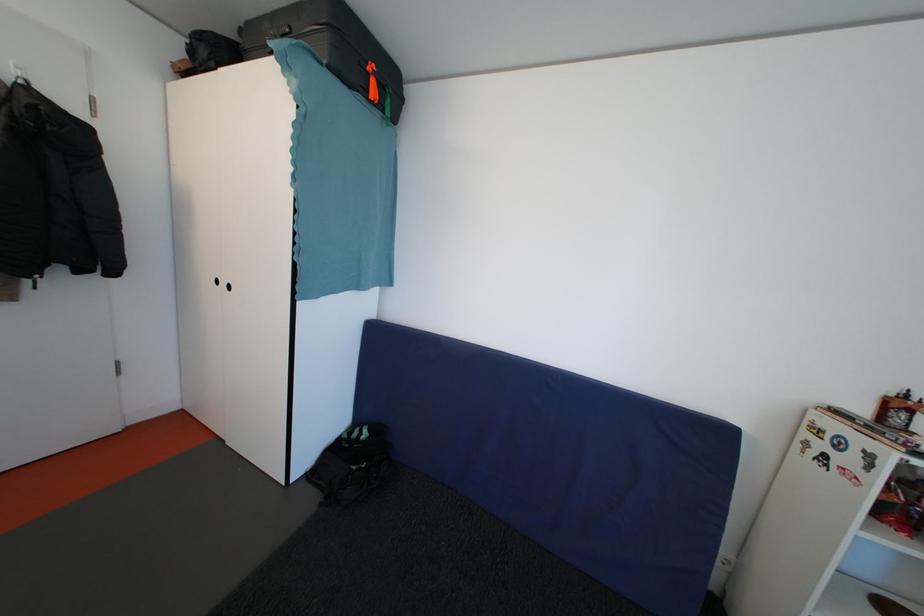
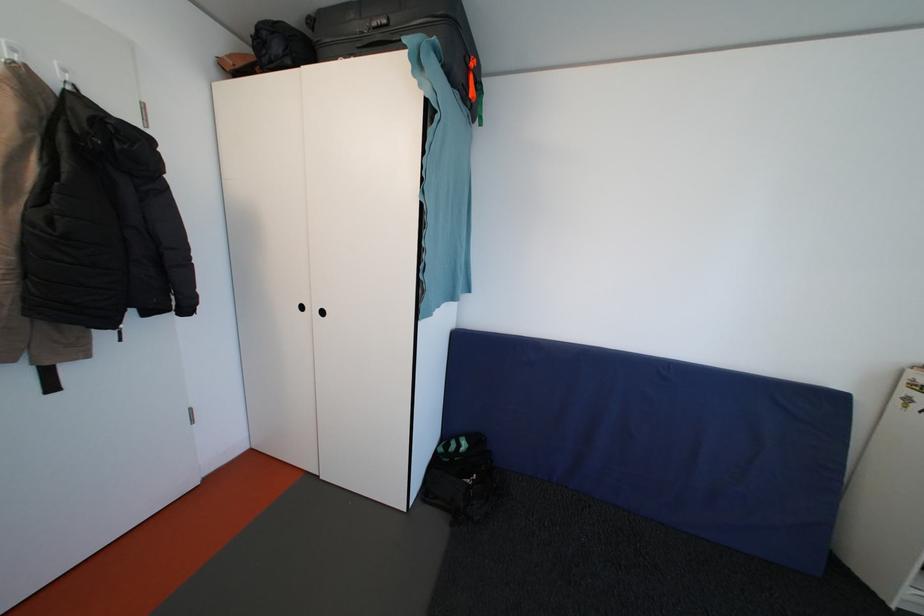
Question: The camera is either moving clockwise (left) or counter-clockwise (right) around the object. The first image is from the beginning of the video and the second image is from the end. Is the camera moving left or right when shooting the video?

Choices:
 (A) Left
 (B) Right

Answer: (A)